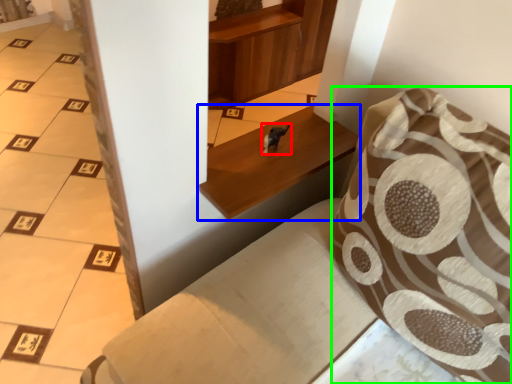
Question: Estimate the real-world distances between objects in this image. Which object is closer to animal (highlighted by a red box), furniture (highlighted by a blue box) or throw pillow (highlighted by a green box)?

Choices:
 (A) furniture
 (B) throw pillow

Answer: (A)